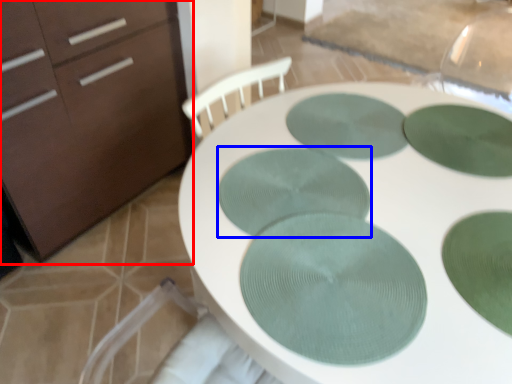
Question: Among these objects, which one is farthest to the camera, chest of drawers (highlighted by a red box) or glass plate (highlighted by a blue box)?

Choices:
 (A) chest of drawers
 (B) glass plate

Answer: (A)